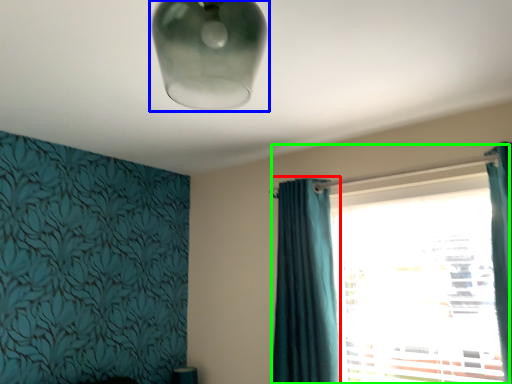
Question: Which object is the closest to the curtain (highlighted by a red box)? Choose among these: lamp (highlighted by a blue box) or window (highlighted by a green box).

Choices:
 (A) lamp
 (B) window

Answer: (B)